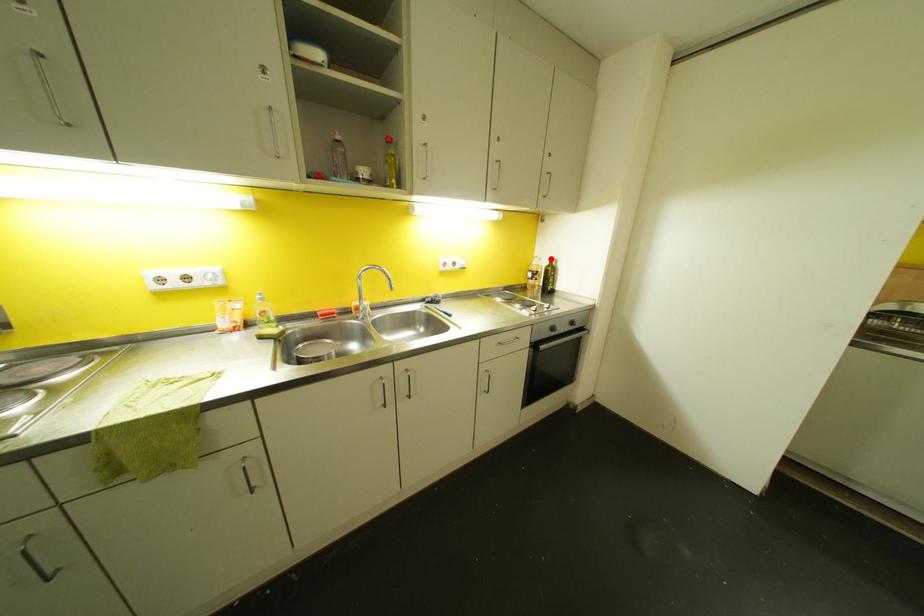
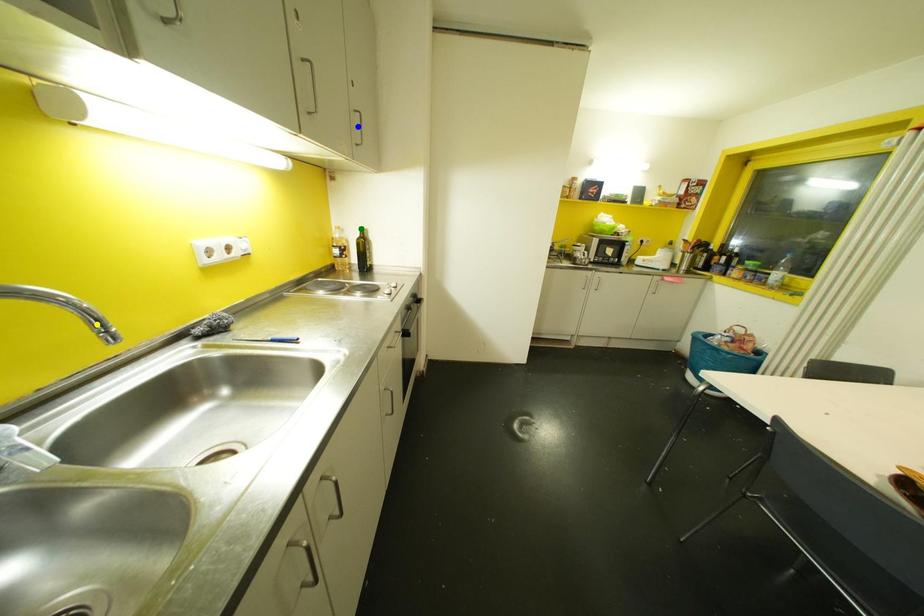
Question: I am providing you with two images of the same scene from different viewpoints. A red point is marked on the first image. You are given multiple points on the second image. Which point in image 2 represents the same 3d spot as the red point in image 1?

Choices:
 (A) green point
 (B) yellow point
 (C) blue point

Answer: (A)